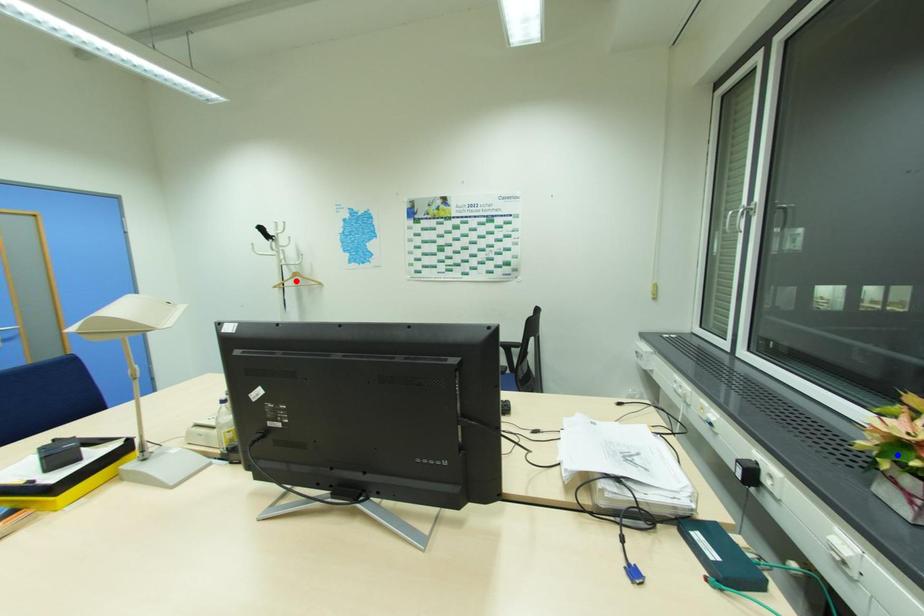
Question: Which of the two points in the image is closer to the camera?

Choices:
 (A) Blue point is closer.
 (B) Red point is closer.

Answer: (A)